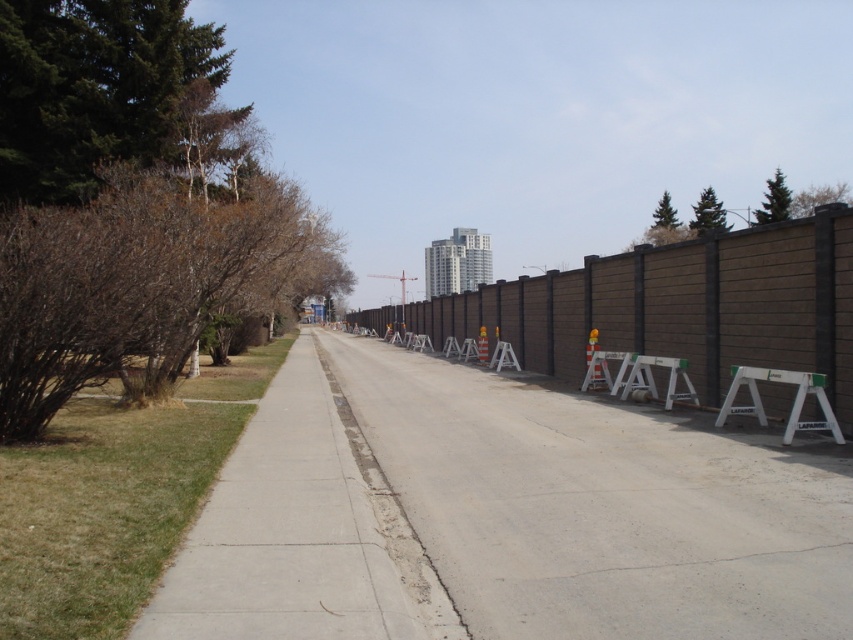
Question: Which of the following is the farthest from the observer?

Choices:
 (A) brown textured fence at center
 (B) gray concrete pavement at center
 (C) gray concrete sidewalk at lower left
 (D) white plastic sawhorse at right

Answer: (A)

Question: Which point appears farthest from the camera in this image?

Choices:
 (A) (780, 374)
 (B) (341, 483)
 (C) (633, 292)

Answer: (C)

Question: Which point is closer to the camera?

Choices:
 (A) gray concrete sidewalk at lower left
 (B) white plastic sawhorse at right

Answer: (A)

Question: Does gray concrete pavement at center lie behind white plastic sawhorse at right?

Choices:
 (A) no
 (B) yes

Answer: (A)

Question: Can you confirm if gray concrete pavement at center is positioned to the left of gray concrete sidewalk at lower left?

Choices:
 (A) no
 (B) yes

Answer: (A)

Question: Is gray concrete sidewalk at lower left positioned behind white plastic sawhorse at right?

Choices:
 (A) no
 (B) yes

Answer: (A)